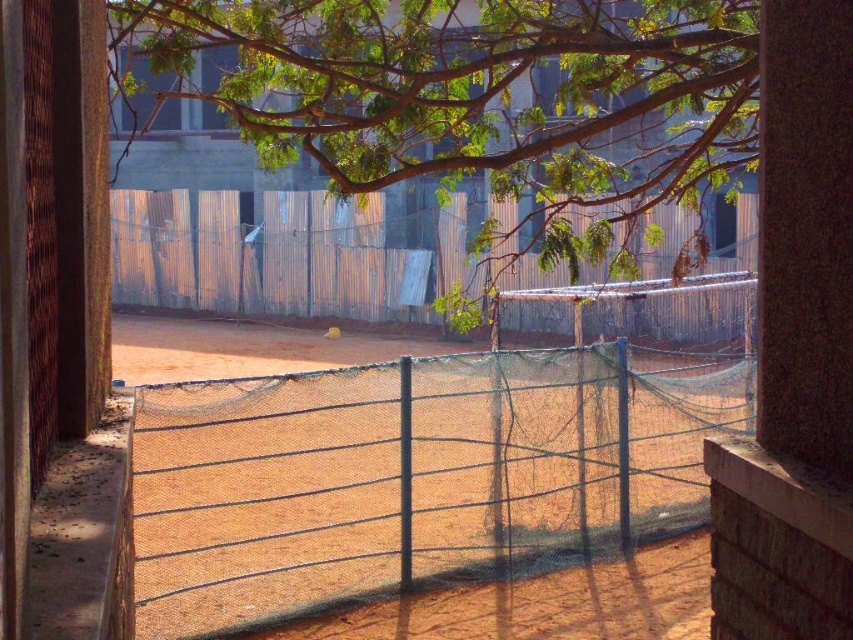
Can you confirm if green mesh tennis net at center is positioned below green leafy tree at upper center?

Correct, green mesh tennis net at center is located below green leafy tree at upper center.

Locate an element on the screen. This screenshot has width=853, height=640. green mesh tennis net at center is located at coordinates (412, 476).

In the scene shown: Is green leafy tree at upper center in front of rusty corrugated metal fence at center?

Yes, green leafy tree at upper center is closer to the viewer.

Does green leafy tree at upper center appear under rusty corrugated metal fence at center?

No, green leafy tree at upper center is not below rusty corrugated metal fence at center.

Where is `green leafy tree at upper center`? green leafy tree at upper center is located at coordinates (480, 97).

Can you confirm if green mesh tennis net at center is wider than rusty corrugated metal fence at center?

No.

What are the coordinates of `green mesh tennis net at center` in the screenshot? It's located at (412, 476).